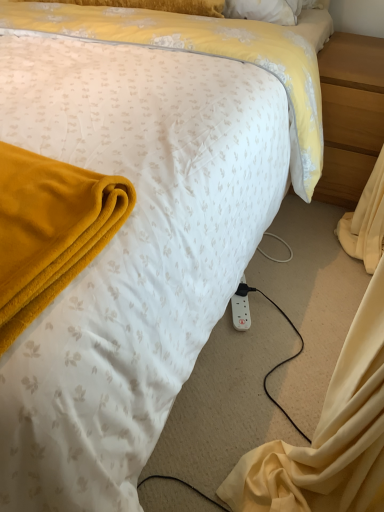
What do you see at coordinates (350, 114) in the screenshot? I see `light brown wood at right` at bounding box center [350, 114].

Measure the distance between light brown wood at right and camera.

The depth of light brown wood at right is 4.78 feet.

This screenshot has width=384, height=512. In order to click on light brown wood at right in this screenshot , I will do point(350,114).

Measure the distance between point (333, 48) and camera.

1.62 meters.

Describe the element at coordinates (240, 312) in the screenshot. I see `white plastic power outlet at lower right` at that location.

Measure the distance between white plastic power outlet at lower right and camera.

white plastic power outlet at lower right is 4.11 feet away from camera.

The height and width of the screenshot is (512, 384). Identify the location of white plastic power outlet at lower right. (240, 312).

What is the approximate width of white plastic power outlet at lower right?

The width of white plastic power outlet at lower right is 11.84 inches.

Locate an element on the screen. This screenshot has width=384, height=512. light brown wood at right is located at coordinates (350, 114).

Which object is positioned more to the left, light brown wood at right or white plastic power outlet at lower right?

white plastic power outlet at lower right is more to the left.

Is light brown wood at right positioned in front of white plastic power outlet at lower right?

No, the depth of light brown wood at right is greater than that of white plastic power outlet at lower right.

Considering the points (327, 110) and (249, 324), which point is in front, point (327, 110) or point (249, 324)?

The point (249, 324) is in front.

From the image's perspective, which one is positioned lower, light brown wood at right or white plastic power outlet at lower right?

white plastic power outlet at lower right is shown below in the image.

From a real-world perspective, which is physically below, light brown wood at right or white plastic power outlet at lower right?

white plastic power outlet at lower right, from a real-world perspective.

Does light brown wood at right have a lesser width compared to white plastic power outlet at lower right?

No.

Considering the relative sizes of light brown wood at right and white plastic power outlet at lower right in the image provided, is light brown wood at right shorter than white plastic power outlet at lower right?

In fact, light brown wood at right may be taller than white plastic power outlet at lower right.

Based on their sizes in the image, would you say light brown wood at right is bigger or smaller than white plastic power outlet at lower right?

light brown wood at right is bigger than white plastic power outlet at lower right.

Would you say light brown wood at right is outside white plastic power outlet at lower right?

light brown wood at right is positioned outside white plastic power outlet at lower right.

Is light brown wood at right in contact with white plastic power outlet at lower right?

No, light brown wood at right is not with white plastic power outlet at lower right.

Does light brown wood at right turn towards white plastic power outlet at lower right?

Yes, light brown wood at right is turned towards white plastic power outlet at lower right.

How many degrees apart are the facing directions of light brown wood at right and white plastic power outlet at lower right?

20.6 degrees.

Locate an element on the screen. The width and height of the screenshot is (384, 512). nightstand that is above the white plastic power outlet at lower right (from a real-world perspective) is located at coordinates (350, 114).

Considering the positions of objects white plastic power outlet at lower right and light brown wood at right in the image provided, who is more to the left, white plastic power outlet at lower right or light brown wood at right?

white plastic power outlet at lower right is more to the left.

Considering the positions of objects white plastic power outlet at lower right and light brown wood at right in the image provided, who is behind, white plastic power outlet at lower right or light brown wood at right?

light brown wood at right is further away from the camera.

Between point (239, 298) and point (333, 63), which one is positioned in front?

Point (239, 298)

From the image's perspective, relative to light brown wood at right, is white plastic power outlet at lower right above or below?

Based on their image positions, white plastic power outlet at lower right is located beneath light brown wood at right.

From a real-world perspective, which object rests below the other?

From a 3D spatial view, white plastic power outlet at lower right is below.

Considering the relative sizes of white plastic power outlet at lower right and light brown wood at right in the image provided, is white plastic power outlet at lower right wider than light brown wood at right?

No.

Considering the sizes of white plastic power outlet at lower right and light brown wood at right in the image, is white plastic power outlet at lower right taller or shorter than light brown wood at right?

Considering their sizes, white plastic power outlet at lower right has less height than light brown wood at right.

Considering the relative sizes of white plastic power outlet at lower right and light brown wood at right in the image provided, is white plastic power outlet at lower right bigger than light brown wood at right?

Incorrect, white plastic power outlet at lower right is not larger than light brown wood at right.

Is white plastic power outlet at lower right outside of light brown wood at right?

Yes.

Is white plastic power outlet at lower right positioned far away from light brown wood at right?

white plastic power outlet at lower right is near light brown wood at right, not far away.

Could you tell me if white plastic power outlet at lower right is turned towards light brown wood at right?

No, white plastic power outlet at lower right does not turn towards light brown wood at right.

Can you tell me how much white plastic power outlet at lower right and light brown wood at right differ in facing direction?

white plastic power outlet at lower right and light brown wood at right are facing 20.6 degrees away from each other.

Image resolution: width=384 pixels, height=512 pixels. In order to click on nightstand behind the white plastic power outlet at lower right in this screenshot , I will do `click(350, 114)`.

Locate an element on the screen. The height and width of the screenshot is (512, 384). power outlet directly beneath the light brown wood at right (from a real-world perspective) is located at coordinates (240, 312).

The width and height of the screenshot is (384, 512). Find the location of `nightstand behind the white plastic power outlet at lower right`. nightstand behind the white plastic power outlet at lower right is located at coordinates (350, 114).